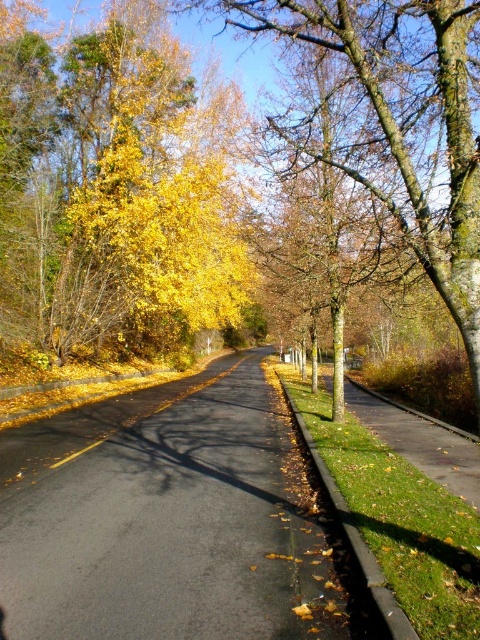
Does yellow leafy tree at left have a smaller size compared to yellow leafy tree at center?

Correct, yellow leafy tree at left occupies less space than yellow leafy tree at center.

This screenshot has height=640, width=480. Identify the location of yellow leafy tree at left. (116, 189).